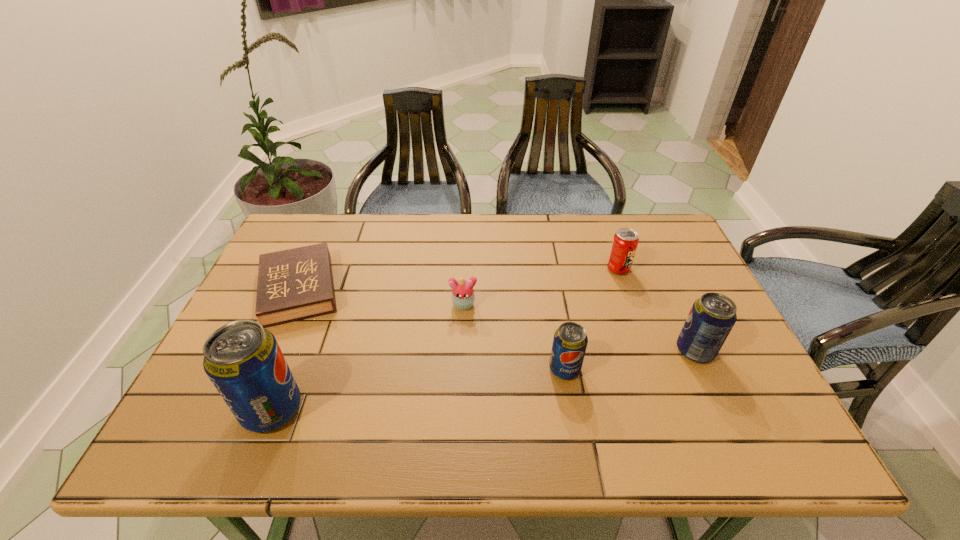
Please determine a free point for an extra pop_(soda) to ensure balance. Please provide its 2D coordinates. Your answer should be formatted as a tuple, i.e. [(x, y)], where the tuple contains the x and y coordinates of a point satisfying the conditions above.

[(424, 388)]